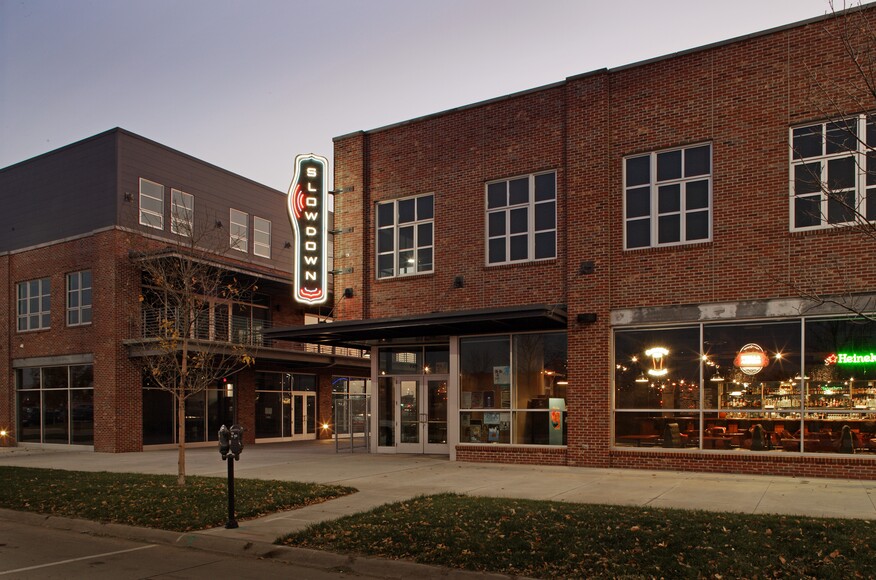
I want to click on window, so click(669, 206).